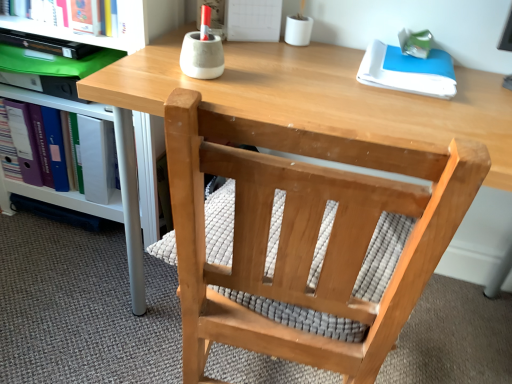
Question: Is purple ring-binder at left positioned behind white glossy shelf at lower left?

Choices:
 (A) yes
 (B) no

Answer: (A)

Question: From a real-world perspective, is purple ring-binder at left positioned under white glossy shelf at lower left based on gravity?

Choices:
 (A) yes
 (B) no

Answer: (A)

Question: Is purple ring-binder at left at the right side of white glossy shelf at lower left?

Choices:
 (A) yes
 (B) no

Answer: (B)

Question: From a real-world perspective, is purple ring-binder at left on white glossy shelf at lower left?

Choices:
 (A) yes
 (B) no

Answer: (B)

Question: Considering the relative sizes of purple ring-binder at left and white glossy shelf at lower left in the image provided, is purple ring-binder at left bigger than white glossy shelf at lower left?

Choices:
 (A) yes
 (B) no

Answer: (B)

Question: Are purple ring-binder at left and white glossy shelf at lower left far apart?

Choices:
 (A) yes
 (B) no

Answer: (B)

Question: Considering the relative sizes of white glossy shelf at lower left and white paper at upper right in the image provided, is white glossy shelf at lower left bigger than white paper at upper right?

Choices:
 (A) no
 (B) yes

Answer: (B)

Question: Can you confirm if white glossy shelf at lower left is smaller than white paper at upper right?

Choices:
 (A) yes
 (B) no

Answer: (B)

Question: From the image's perspective, would you say white glossy shelf at lower left is positioned over white paper at upper right?

Choices:
 (A) yes
 (B) no

Answer: (B)

Question: From a real-world perspective, does white glossy shelf at lower left stand above white paper at upper right?

Choices:
 (A) no
 (B) yes

Answer: (A)

Question: Would you say white paper at upper right is part of white glossy shelf at lower left's contents?

Choices:
 (A) no
 (B) yes

Answer: (A)

Question: Does white glossy shelf at lower left appear on the right side of white paper at upper right?

Choices:
 (A) no
 (B) yes

Answer: (A)

Question: Can you confirm if natural wood chair at center is thinner than purple ring-binder at left?

Choices:
 (A) no
 (B) yes

Answer: (A)